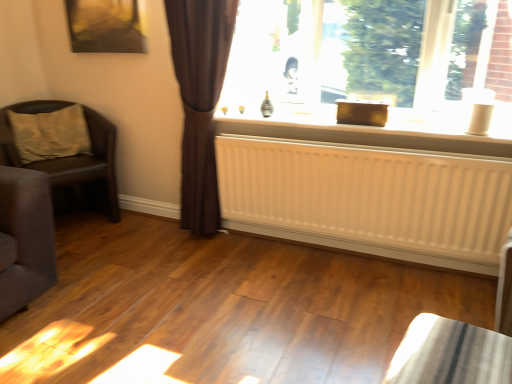
The image size is (512, 384). Describe the element at coordinates (71, 161) in the screenshot. I see `brown leather chair at left` at that location.

In order to face white plastic window sill at center, should I rotate leftwards or rightwards?

To face it directly, rotate right by 12.924 degrees.

I want to click on brown sheer curtain at left, so click(x=200, y=101).

Describe the element at coordinates (366, 67) in the screenshot. This screenshot has height=384, width=512. I see `matte white window sill at upper center` at that location.

What do you see at coordinates (369, 199) in the screenshot?
I see `white matte radiator at center` at bounding box center [369, 199].

You are a GUI agent. You are given a task and a screenshot of the screen. Output one action in this format:
    pyautogui.click(x=<x>, y=<y>)
    Task: Click on the brown leather chair at left
    The height and width of the screenshot is (384, 512).
    Given the screenshot: What is the action you would take?
    pyautogui.click(x=71, y=161)

Do you think brown leather chair at left is within white matte radiator at center, or outside of it?

brown leather chair at left exists outside the volume of white matte radiator at center.

Are brown leather chair at left and white matte radiator at center far apart?

That's right, there is a large distance between brown leather chair at left and white matte radiator at center.

From a real-world perspective, which object rests below the other?

white matte radiator at center, from a real-world perspective.

Is brown leather chair at left aimed at white matte radiator at center?

No, brown leather chair at left is not oriented towards white matte radiator at center.

Consider the image. Would you say shiny metallic table at lower right is to the left or to the right of matte white window sill at upper center in the picture?

In the image, shiny metallic table at lower right appears on the right side of matte white window sill at upper center.

You are a GUI agent. You are given a task and a screenshot of the screen. Output one action in this format:
    pyautogui.click(x=<x>, y=<y>)
    Task: Click on the furniture lying in front of the matte white window sill at upper center
    This screenshot has height=384, width=512.
    Given the screenshot: What is the action you would take?
    (x=450, y=354)

Which is farther from the camera, [412,342] or [435,24]?

Positioned behind is point [435,24].

Measure the distance from metallic gold picture frame at upper left to shiny metallic table at lower right.

A: metallic gold picture frame at upper left and shiny metallic table at lower right are 2.27 meters apart.

From a real-world perspective, which is physically above, metallic gold picture frame at upper left or shiny metallic table at lower right?

metallic gold picture frame at upper left is physically above.

Where is `picture frame above the shiny metallic table at lower right (from the image's perspective)`? The height and width of the screenshot is (384, 512). picture frame above the shiny metallic table at lower right (from the image's perspective) is located at coordinates (105, 26).

Is metallic gold picture frame at upper left spatially inside shiny metallic table at lower right, or outside of it?

The correct answer is: outside.

Is metallic gold picture frame at upper left to the right of brown sheer curtain at left from the viewer's perspective?

No, metallic gold picture frame at upper left is not to the right of brown sheer curtain at left.

What's the angular difference between metallic gold picture frame at upper left and brown sheer curtain at left's facing directions?

1.99 degrees separate the facing orientations of metallic gold picture frame at upper left and brown sheer curtain at left.

Is metallic gold picture frame at upper left turned away from brown sheer curtain at left?

metallic gold picture frame at upper left does not have its back to brown sheer curtain at left.

Is point (115, 29) closer or farther from the camera than point (193, 229)?

Point (115, 29) appears to be closer to the viewer than point (193, 229).

Considering the relative sizes of beige fabric pillow at left and matte white window sill at upper center in the image provided, is beige fabric pillow at left wider than matte white window sill at upper center?

Indeed, beige fabric pillow at left has a greater width compared to matte white window sill at upper center.

Is beige fabric pillow at left closer to the viewer compared to matte white window sill at upper center?

No.

Is there a large distance between beige fabric pillow at left and matte white window sill at upper center?

Yes, beige fabric pillow at left and matte white window sill at upper center are quite far apart.

How many degrees apart are the facing directions of beige fabric pillow at left and matte white window sill at upper center?

64.6 degrees.

Is matte white window sill at upper center next to shiny metallic table at lower right?

matte white window sill at upper center is not next to shiny metallic table at lower right, and they're not touching.

Based on their sizes in the image, would you say matte white window sill at upper center is bigger or smaller than shiny metallic table at lower right?

matte white window sill at upper center is bigger than shiny metallic table at lower right.

Is point (316, 47) farther from viewer compared to point (459, 368)?

Yes, point (316, 47) is farther from viewer.

Who is taller, matte white window sill at upper center or shiny metallic table at lower right?

matte white window sill at upper center.

From the picture: Could you tell me if white matte radiator at center is turned towards metallic gold picture frame at upper left?

No, white matte radiator at center is not aimed at metallic gold picture frame at upper left.

Is the position of white matte radiator at center more distant than that of metallic gold picture frame at upper left?

No.

Image resolution: width=512 pixels, height=384 pixels. In the image, there is a metallic gold picture frame at upper left. What are the coordinates of `radiator below it (from the image's perspective)` in the screenshot? It's located at (369, 199).

How distant is white matte radiator at center from metallic gold picture frame at upper left?

white matte radiator at center is 4.28 feet from metallic gold picture frame at upper left.

Image resolution: width=512 pixels, height=384 pixels. I want to click on chair on the left of white matte radiator at center, so click(71, 161).

In order to click on furniture below the matte white window sill at upper center (from the image's perspective) in this screenshot , I will do `click(450, 354)`.

Consider the image. When comparing their distances from brown sheer curtain at left, does beige fabric pillow at left or brown leather chair at left seem closer?

The object closer to brown sheer curtain at left is brown leather chair at left.

From the image, which object appears to be farther from brown leather chair at left, beige fabric pillow at left or white plastic window sill at center?

Among the two, white plastic window sill at center is located further to brown leather chair at left.

Consider the image. From the image, which object appears to be farther from white matte radiator at center, brown leather chair at left or matte white window sill at upper center?

brown leather chair at left is positioned further to the anchor white matte radiator at center.

From the picture: Looking at the image, which one is located closer to beige fabric pillow at left, white matte radiator at center or metallic gold picture frame at upper left?

metallic gold picture frame at upper left is positioned closer to the anchor beige fabric pillow at left.

Considering their positions, is brown sheer curtain at left positioned further to matte white window sill at upper center than metallic gold picture frame at upper left?

metallic gold picture frame at upper left lies further to matte white window sill at upper center than the other object.

Which object lies nearer to the anchor point matte white window sill at upper center, beige fabric pillow at left or brown sheer curtain at left?

Based on the image, brown sheer curtain at left appears to be nearer to matte white window sill at upper center.

Estimate the real-world distances between objects in this image. Which object is closer to white matte radiator at center, matte white window sill at upper center or brown sheer curtain at left?

Based on the image, matte white window sill at upper center appears to be nearer to white matte radiator at center.

When comparing their distances from white plastic window sill at center, does white matte radiator at center or beige fabric pillow at left seem further?

beige fabric pillow at left is further to white plastic window sill at center.

The height and width of the screenshot is (384, 512). Find the location of `radiator located between beige fabric pillow at left and white plastic window sill at center in the left-right direction`. radiator located between beige fabric pillow at left and white plastic window sill at center in the left-right direction is located at coordinates (369, 199).

Where is `picture frame between beige fabric pillow at left and matte white window sill at upper center in the horizontal direction`? Image resolution: width=512 pixels, height=384 pixels. picture frame between beige fabric pillow at left and matte white window sill at upper center in the horizontal direction is located at coordinates [x=105, y=26].

This screenshot has width=512, height=384. What are the coordinates of `picture frame situated between brown leather chair at left and matte white window sill at upper center from left to right` in the screenshot? It's located at (105, 26).

Identify the location of curtain situated between metallic gold picture frame at upper left and matte white window sill at upper center from left to right. (200, 101).